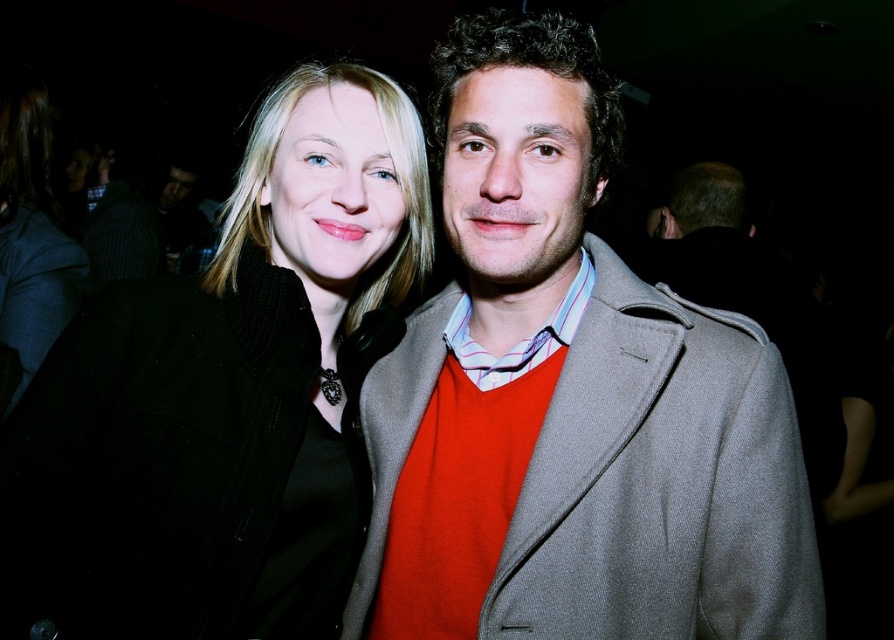
Based on the photo, you are at a party and want to take a photo of the striped fabric shirt at left and the matte gray coat at center. Since the lighting is dim, you need to ensure both are in the frame. Given their positions, which object should you focus on first to capture both in the shot?

The striped fabric shirt at left should be focused on first since the matte gray coat at center is to the right of it, meaning the shirt is closer to the left edge of the frame. By centering the shirt and adjusting the camera angle slightly to the right, both items can be included in the photo.

You are at a social event and want to take a photo of the two people in the image. You have a camera with a minimum focusing distance of 40 inches. Can you take a clear photo of the point at point (469,436) without moving closer?

The distance between the point (469,436) and the viewer is 38.69 inches, which is less than the camera minimum focusing distance of 40 inches. Therefore, the camera cannot focus clearly on the point at point (469,436).

You are a photographer at a crowded event. You need to capture a photo of both the matte gray coat at center and the black woolen coat at left without any overlap between them. Given that your camera has a minimum focus distance of 9 inches, can you take the photo as required?

The matte gray coat at center and the black woolen coat at left are 8.75 inches apart, which is less than the camera minimum focus distance of 9 inches. Therefore, you cannot take the photo without overlap between them.